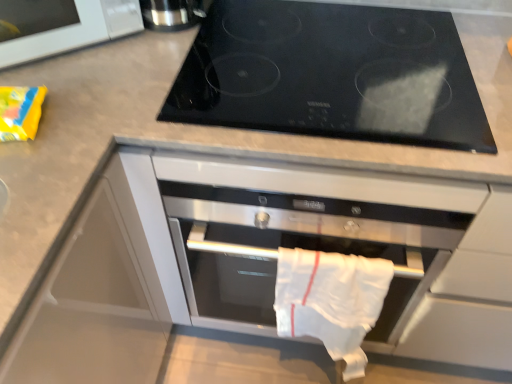
Question: Based on their sizes in the image, would you say black glass cooktop at upper center is bigger or smaller than satin silver thermos at upper left?

Choices:
 (A) small
 (B) big

Answer: (B)

Question: From a real-world perspective, is black glass cooktop at upper center positioned above or below satin silver thermos at upper left?

Choices:
 (A) above
 (B) below

Answer: (B)

Question: Based on their relative distances, which object is nearer to the white glossy microwave at upper left?

Choices:
 (A) black glass cooktop at upper center
 (B) satin silver thermos at upper left
 (C) white cotton towel at center

Answer: (B)

Question: Considering the real-world distances, which object is closest to the satin silver thermos at upper left?

Choices:
 (A) white cotton towel at center
 (B) white glossy microwave at upper left
 (C) black glass cooktop at upper center

Answer: (B)